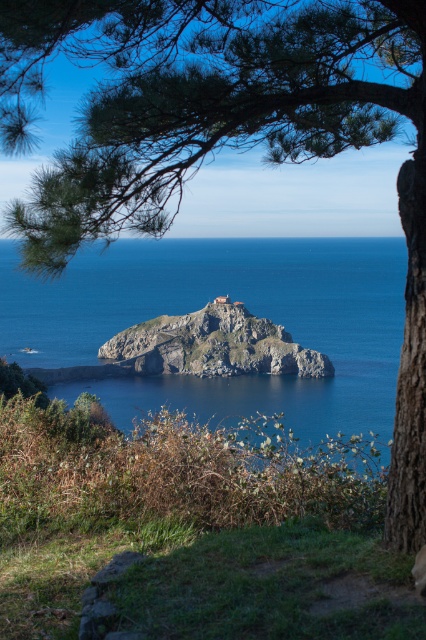
Question: Among these points, which one is nearest to the camera?

Choices:
 (A) (74, 305)
 (B) (218, 298)

Answer: (B)

Question: Which of the following is the closest to the observer?

Choices:
 (A) (350, 262)
 (B) (192, 339)

Answer: (B)

Question: Does blue water at center appear under brown rocky island at center?

Choices:
 (A) no
 (B) yes

Answer: (A)

Question: Is blue water at center positioned at the back of brown rocky island at center?

Choices:
 (A) yes
 (B) no

Answer: (B)

Question: Does blue water at center come behind brown rocky island at center?

Choices:
 (A) no
 (B) yes

Answer: (A)